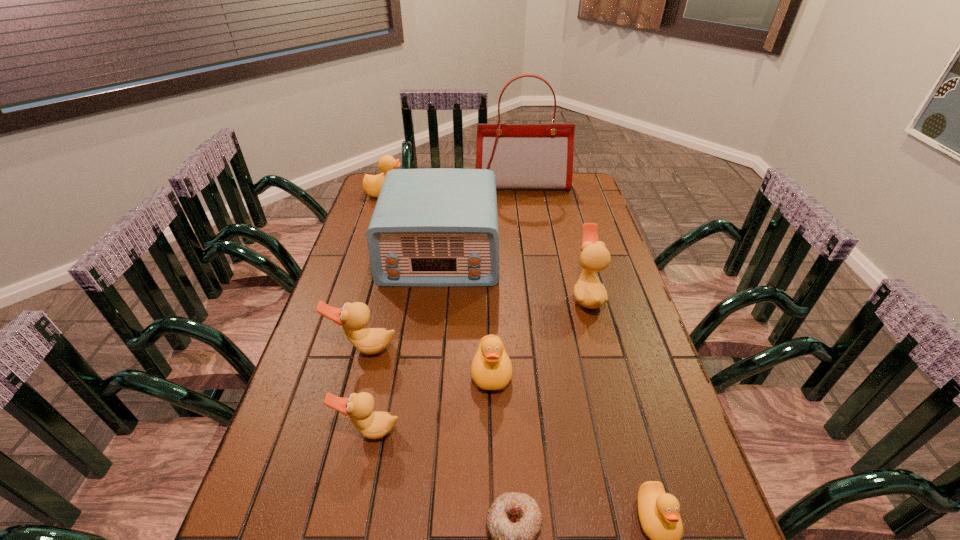
Identify the location of vacant region between the second smallest tan duck and the radio receiver. The width and height of the screenshot is (960, 540). (402, 301).

The image size is (960, 540). Identify the location of empty space between the second nearest duck and the second farthest yellow duck. (430, 401).

Identify the location of object that is the fourth nearest to the second smallest yellow duck. (514, 519).

Locate which object ranks second in proximity to the doughnut. Please provide its 2D coordinates. Your answer should be formatted as a tuple, i.e. [(x, y)], where the tuple contains the x and y coordinates of a point satisfying the conditions above.

[(373, 425)]

Identify which duck is the fourth nearest to the farthest duck. Please provide its 2D coordinates. Your answer should be formatted as a tuple, i.e. [(x, y)], where the tuple contains the x and y coordinates of a point satisfying the conditions above.

[(373, 425)]

Select which duck is the fifth closest to the radio receiver. Please provide its 2D coordinates. Your answer should be formatted as a tuple, i.e. [(x, y)], where the tuple contains the x and y coordinates of a point satisfying the conditions above.

[(373, 425)]

Locate an element on the screen. This screenshot has height=540, width=960. tan duck that is the nearest to the second yellow duck from left to right is located at coordinates (373, 425).

This screenshot has height=540, width=960. Identify the location of tan duck object that ranks as the third closest to the shortest object. (588, 291).

Identify the location of the third closest yellow duck to the shortest object. Image resolution: width=960 pixels, height=540 pixels. (372, 184).

Point out which yellow duck is positioned as the nearest to the biggest yellow duck. Please provide its 2D coordinates. Your answer should be formatted as a tuple, i.e. [(x, y)], where the tuple contains the x and y coordinates of a point satisfying the conditions above.

[(491, 369)]